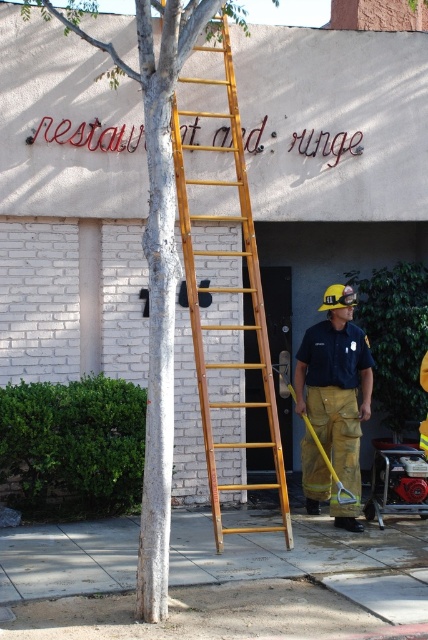
You are a firefighter trying to reach the roof of the building. You see a white textured tree at center and a wooden ladder at center. Which object should you use to climb up?

The wooden ladder at center is the correct tool for climbing to the roof, so you should use the wooden ladder at center instead of the white textured tree at center.